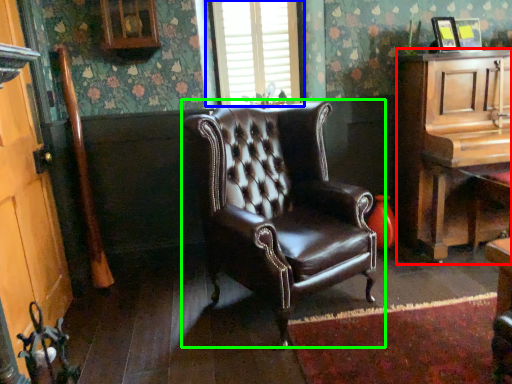
Question: Which is nearer to the cabinetry (highlighted by a red box)? window (highlighted by a blue box) or chair (highlighted by a green box).

Choices:
 (A) window
 (B) chair

Answer: (B)